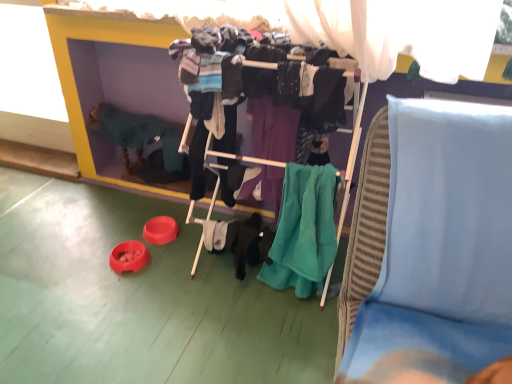
Question: Is light blue fabric at upper right not within knitted green sweater at left?

Choices:
 (A) no
 (B) yes

Answer: (B)

Question: Can you confirm if light blue fabric at upper right is bigger than knitted green sweater at left?

Choices:
 (A) no
 (B) yes

Answer: (B)

Question: Can you confirm if light blue fabric at upper right is smaller than knitted green sweater at left?

Choices:
 (A) no
 (B) yes

Answer: (A)

Question: Is light blue fabric at upper right in front of knitted green sweater at left?

Choices:
 (A) no
 (B) yes

Answer: (B)

Question: Does light blue fabric at upper right come behind knitted green sweater at left?

Choices:
 (A) yes
 (B) no

Answer: (B)

Question: Does point (439, 349) appear closer or farther from the camera than point (112, 135)?

Choices:
 (A) farther
 (B) closer

Answer: (B)

Question: Is light blue fabric at upper right bigger or smaller than knitted green sweater at left?

Choices:
 (A) big
 (B) small

Answer: (A)

Question: From a real-world perspective, is light blue fabric at upper right above or below knitted green sweater at left?

Choices:
 (A) below
 (B) above

Answer: (B)

Question: Choose the correct answer: Is light blue fabric at upper right inside knitted green sweater at left or outside it?

Choices:
 (A) inside
 (B) outside

Answer: (B)

Question: Is teal fabric clothes at center taller or shorter than teal soft towel at center?

Choices:
 (A) tall
 (B) short

Answer: (A)

Question: Visually, is teal fabric clothes at center positioned to the left or to the right of teal soft towel at center?

Choices:
 (A) left
 (B) right

Answer: (A)

Question: Looking at their shapes, would you say teal fabric clothes at center is wider or thinner than teal soft towel at center?

Choices:
 (A) wide
 (B) thin

Answer: (A)

Question: From the image's perspective, is teal fabric clothes at center above or below teal soft towel at center?

Choices:
 (A) above
 (B) below

Answer: (A)

Question: In the image, is teal fabric clothes at center positioned in front of or behind light blue fabric at upper right?

Choices:
 (A) front
 (B) behind

Answer: (B)

Question: From a real-world perspective, is teal fabric clothes at center above or below light blue fabric at upper right?

Choices:
 (A) above
 (B) below

Answer: (A)